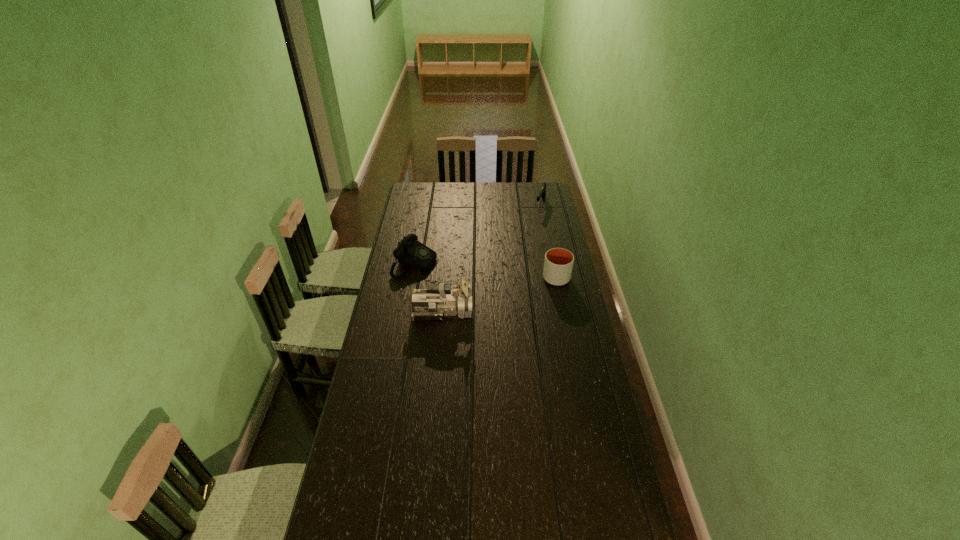
Identify the location of the nearest object. This screenshot has height=540, width=960. click(438, 300).

Find the location of a particular element. camcorder is located at coordinates (438, 300).

This screenshot has width=960, height=540. What are the coordinates of `cup` in the screenshot? It's located at (558, 264).

Where is `the farthest object`? This screenshot has width=960, height=540. the farthest object is located at coordinates (542, 193).

Find the location of a particular element. telephone is located at coordinates (410, 252).

In order to click on free space located on the front-facing side of the camcorder in this screenshot , I will do `click(511, 312)`.

Find the location of a particular element. free space located on the front of the cup is located at coordinates (564, 312).

At what (x,y) coordinates should I click in order to perform the action: click on vacant space situated 0.110m at the aiming end of the farthest object. Please return your answer as a coordinate pair (x, y). The image size is (960, 540). Looking at the image, I should click on (536, 222).

What are the coordinates of `vacant space located at the aiming end of the farthest object` in the screenshot? It's located at (532, 230).

The width and height of the screenshot is (960, 540). I want to click on vacant space located 0.050m at the aiming end of the farthest object, so click(x=538, y=217).